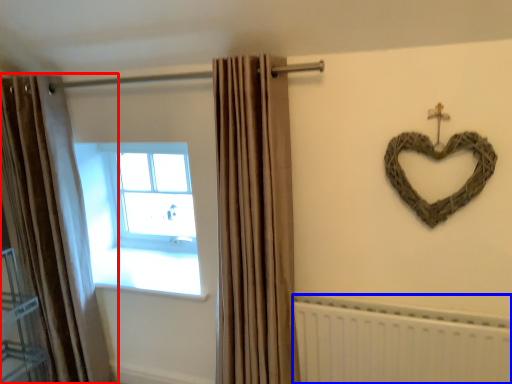
Question: Which point is closer to the camera, curtain (highlighted by a red box) or radiator (highlighted by a blue box)?

Choices:
 (A) curtain
 (B) radiator

Answer: (B)